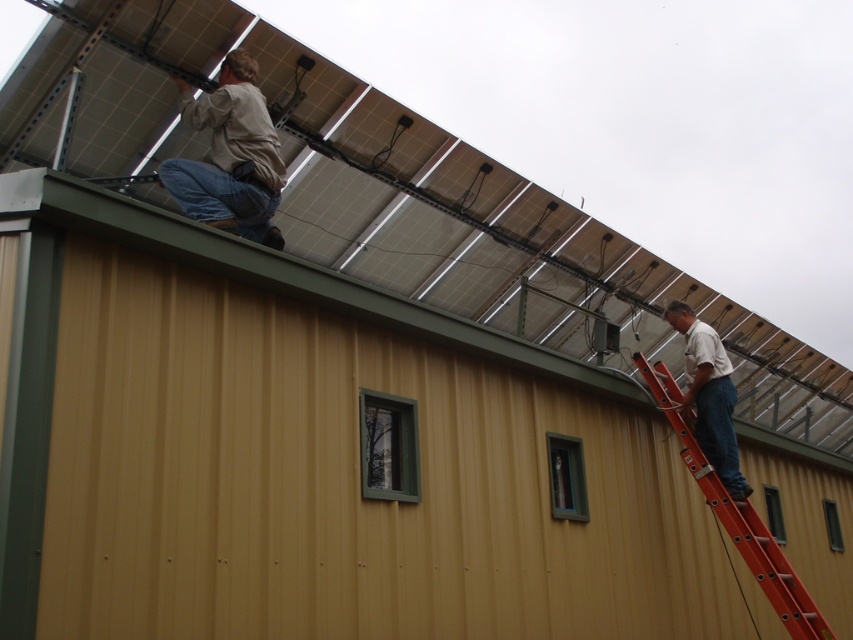
Between point (84, 42) and point (227, 81), which one is positioned behind?

The point (227, 81) is behind.

Where is `metallic solar panels at upper center`? This screenshot has height=640, width=853. metallic solar panels at upper center is located at coordinates (381, 193).

Is metallic solar panels at upper center taller than orange fiberglass ladder at upper right?

Yes, metallic solar panels at upper center is taller than orange fiberglass ladder at upper right.

Is metallic solar panels at upper center wider than orange fiberglass ladder at upper right?

Yes.

Find the location of a particular element. The height and width of the screenshot is (640, 853). metallic solar panels at upper center is located at coordinates (381, 193).

In the scene shown: Is light brown denim jeans at upper center below white matte shirt at right?

Actually, light brown denim jeans at upper center is above white matte shirt at right.

How distant is light brown denim jeans at upper center from white matte shirt at right?

light brown denim jeans at upper center is 4.30 meters from white matte shirt at right.

What do you see at coordinates (230, 156) in the screenshot? This screenshot has width=853, height=640. I see `light brown denim jeans at upper center` at bounding box center [230, 156].

Locate an element on the screen. The height and width of the screenshot is (640, 853). light brown denim jeans at upper center is located at coordinates (230, 156).